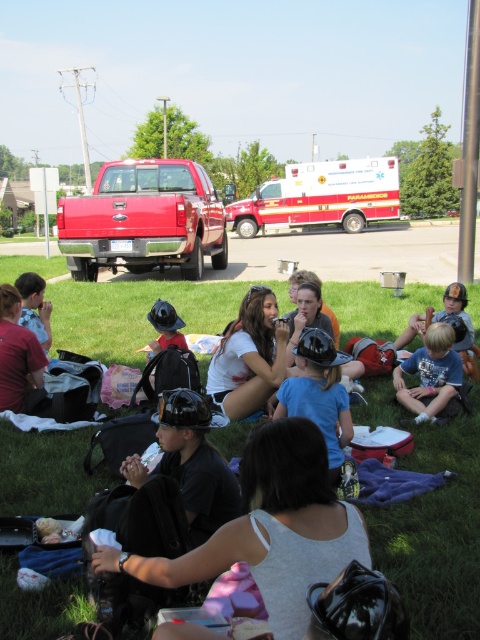
Between green grass at lower center and matte black helmet at center, which one appears on the left side from the viewer's perspective?

Positioned to the left is matte black helmet at center.

Is point (427, 634) positioned before point (7, 307)?

That is True.

Identify the location of green grass at lower center. This screenshot has height=640, width=480. (436, 532).

Between green grass at lower center and white glossy ambulance at center, which one appears on the left side from the viewer's perspective?

From the viewer's perspective, green grass at lower center appears more on the left side.

Is point (441, 524) less distant than point (284, 192)?

That is True.

Identify the location of green grass at lower center. This screenshot has width=480, height=640. (436, 532).

You are a GUI agent. You are given a task and a screenshot of the screen. Output one action in this format:
    pyautogui.click(x=<x>, y=<y>)
    Task: Click on the red matte pickup truck at center
    This screenshot has width=480, height=640.
    Given the screenshot: What is the action you would take?
    pyautogui.click(x=144, y=220)

Does red matte pickup truck at center have a lesser width compared to white matte shirt at center?

Incorrect, red matte pickup truck at center's width is not less than white matte shirt at center's.

Where is `red matte pickup truck at center`? This screenshot has width=480, height=640. red matte pickup truck at center is located at coordinates (144, 220).